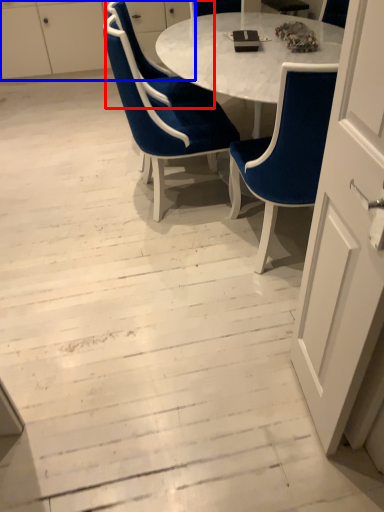
Question: Which point is further to the camera, chair (highlighted by a red box) or dresser (highlighted by a blue box)?

Choices:
 (A) chair
 (B) dresser

Answer: (B)